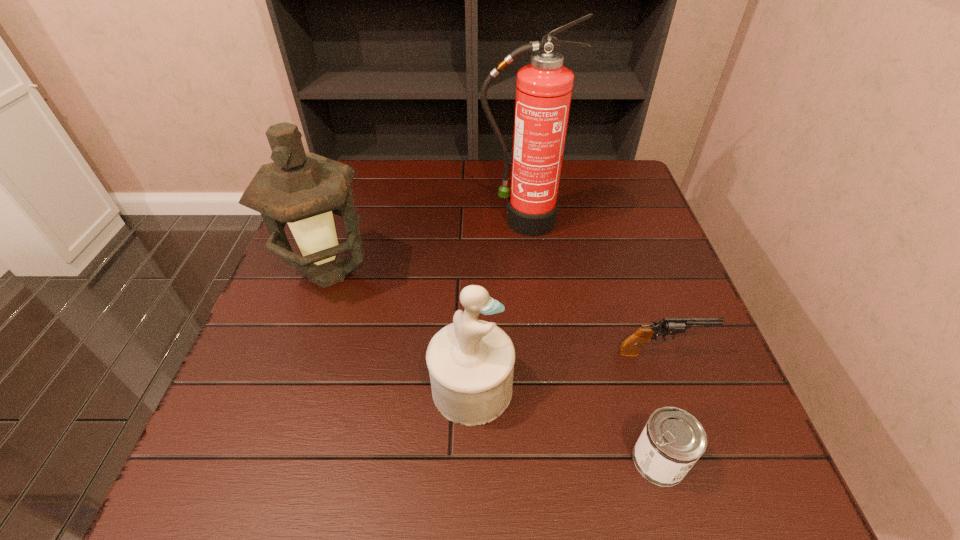
Locate an element on the screen. free space located on the left of the can is located at coordinates (494, 460).

Where is `object situated at the near edge`? The width and height of the screenshot is (960, 540). object situated at the near edge is located at coordinates point(672,441).

This screenshot has width=960, height=540. What are the coordinates of `object positioned at the left edge` in the screenshot? It's located at pos(303,190).

You are a GUI agent. You are given a task and a screenshot of the screen. Output one action in this format:
    pyautogui.click(x=<x>, y=<y>)
    Task: Click on the gun at the right edge
    
    Given the screenshot: What is the action you would take?
    pyautogui.click(x=631, y=346)

Locate an element on the screen. The width and height of the screenshot is (960, 540). can that is at the right edge is located at coordinates (672, 441).

At what (x,y) coordinates should I click in order to perform the action: click on object that is at the near right corner. Please return your answer as a coordinate pair (x, y). Looking at the image, I should click on (672, 441).

The width and height of the screenshot is (960, 540). Identify the location of free spot at the far edge of the desktop. (511, 176).

Locate an element on the screen. This screenshot has height=540, width=960. free space at the near edge of the desktop is located at coordinates (315, 487).

The width and height of the screenshot is (960, 540). Find the location of `vacant space at the left edge of the desktop`. vacant space at the left edge of the desktop is located at coordinates (312, 338).

In the image, there is a desktop. In order to click on vacant space at the right edge in this screenshot , I will do `click(610, 208)`.